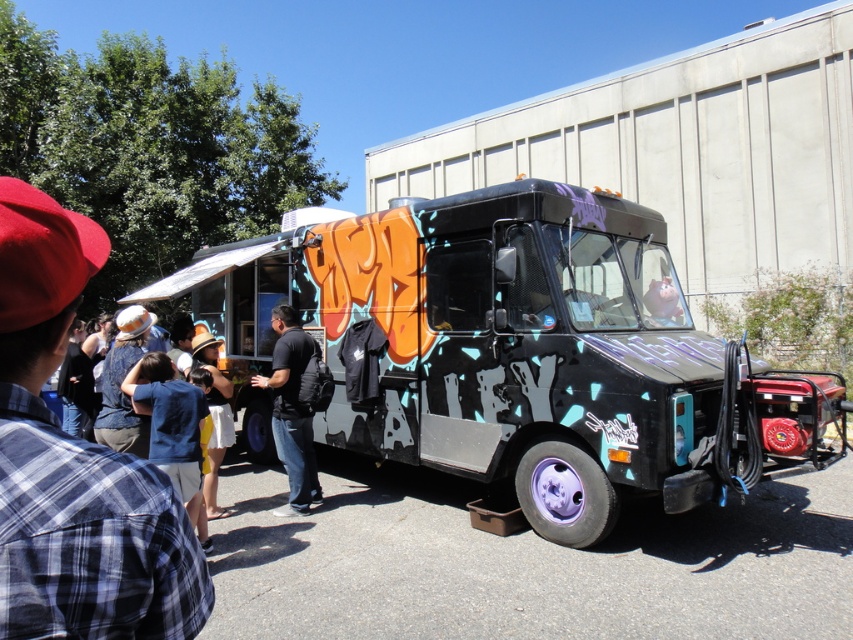
Is graffiti-covered truck at center shorter than black matte backpack at center?

No, graffiti-covered truck at center is not shorter than black matte backpack at center.

Is graffiti-covered truck at center positioned in front of black matte backpack at center?

Yes, graffiti-covered truck at center is closer to the viewer.

Which is in front, point (750, 470) or point (289, 316)?

Positioned in front is point (750, 470).

Locate an element on the screen. The width and height of the screenshot is (853, 640). graffiti-covered truck at center is located at coordinates (511, 352).

Who is more distant from viewer, (306,362) or (219,390)?

Point (219,390)

This screenshot has width=853, height=640. Describe the element at coordinates (291, 410) in the screenshot. I see `black matte backpack at center` at that location.

This screenshot has height=640, width=853. Find the location of `black matte backpack at center`. black matte backpack at center is located at coordinates (291, 410).

What do you see at coordinates (74, 464) in the screenshot? The height and width of the screenshot is (640, 853). I see `plaid fabric shirt at left` at bounding box center [74, 464].

Looking at this image, is plaid fabric shirt at left taller than yellow cotton shirt at center?

In fact, plaid fabric shirt at left may be shorter than yellow cotton shirt at center.

I want to click on plaid fabric shirt at left, so pos(74,464).

Where is `plaid fabric shirt at left`? This screenshot has width=853, height=640. plaid fabric shirt at left is located at coordinates (74, 464).